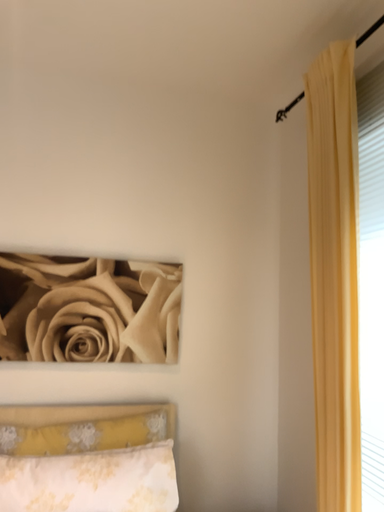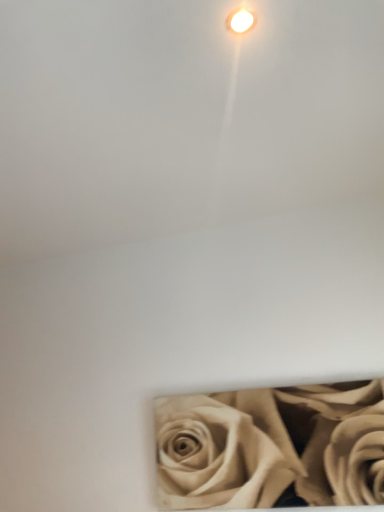
Question: Which way did the camera rotate in the video?

Choices:
 (A) rotated right
 (B) rotated left

Answer: (B)